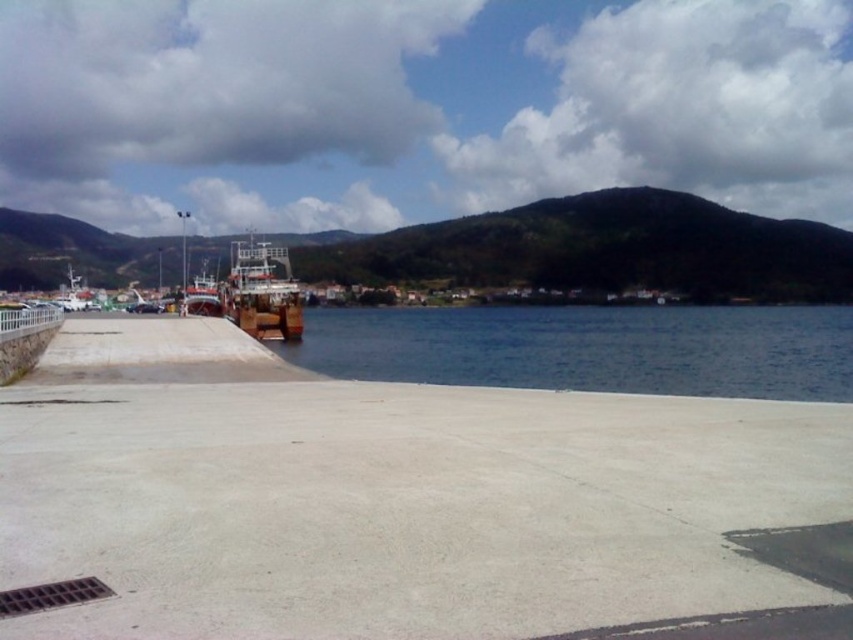
Question: Can you confirm if concrete at center is positioned to the right of wooden boat at center?

Choices:
 (A) no
 (B) yes

Answer: (B)

Question: Which object is the closest to the blue water at center?

Choices:
 (A) concrete at center
 (B) wooden boat at center
 (C) wooden ship at center
 (D) wooden boat at left

Answer: (A)

Question: Which object is the closest to the concrete at center?

Choices:
 (A) blue water at center
 (B) wooden boat at left
 (C) wooden ship at center
 (D) wooden boat at center

Answer: (A)

Question: Observing the image, what is the correct spatial positioning of blue water at center in reference to wooden boat at left?

Choices:
 (A) right
 (B) left

Answer: (A)

Question: Which is nearer to the wooden ship at center?

Choices:
 (A) concrete at center
 (B) blue water at center
 (C) wooden boat at center

Answer: (C)

Question: From the image, what is the correct spatial relationship of blue water at center in relation to wooden boat at left?

Choices:
 (A) above
 (B) below

Answer: (B)